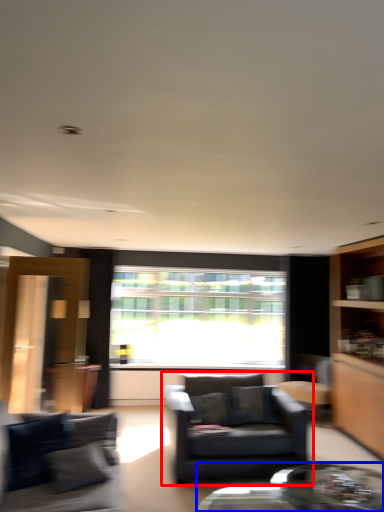
Question: Among these objects, which one is nearest to the camera, chair (highlighted by a red box) or coffee table (highlighted by a blue box)?

Choices:
 (A) chair
 (B) coffee table

Answer: (B)